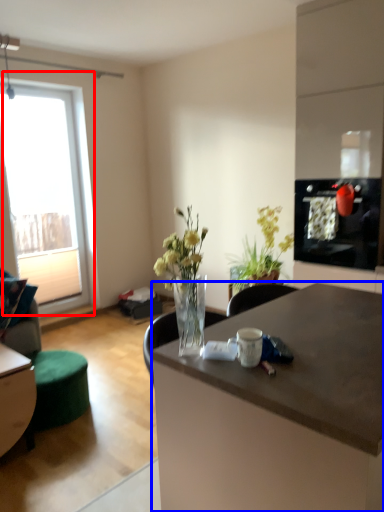
Question: Among these objects, which one is nearest to the camera, window (highlighted by a red box) or desk (highlighted by a blue box)?

Choices:
 (A) window
 (B) desk

Answer: (B)